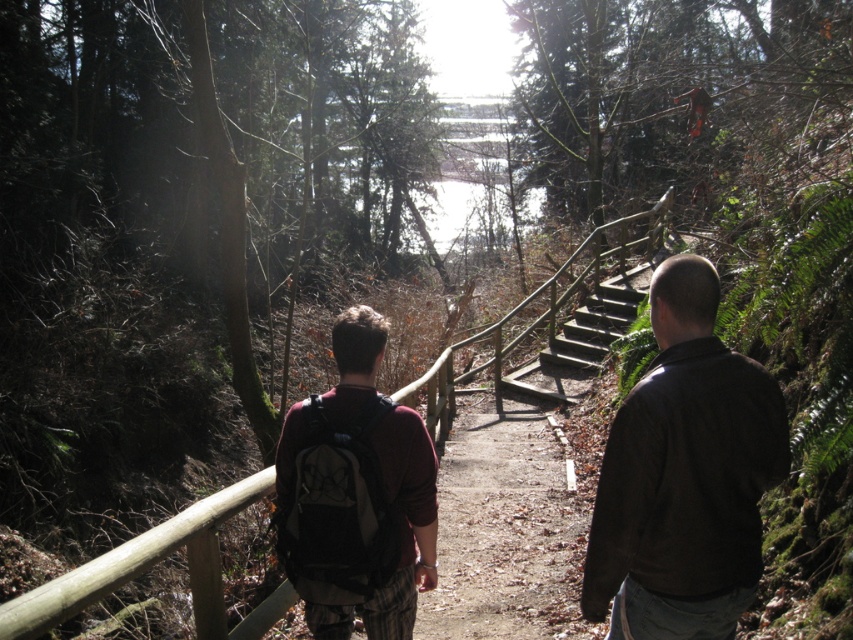
Question: Estimate the real-world distances between objects in this image. Which object is farther from the wooden at center?

Choices:
 (A) dark brown leather jacket at right
 (B) maroon fabric backpack at center

Answer: (B)

Question: Which object appears farthest from the camera in this image?

Choices:
 (A) dark brown leather jacket at right
 (B) wooden at center

Answer: (A)

Question: Is dark brown leather jacket at right below maroon fabric backpack at center?

Choices:
 (A) yes
 (B) no

Answer: (B)

Question: Can you confirm if maroon fabric backpack at center is smaller than wooden at center?

Choices:
 (A) yes
 (B) no

Answer: (A)

Question: Which point is closer to the camera?

Choices:
 (A) (738, 508)
 (B) (204, 525)

Answer: (A)

Question: Does maroon fabric backpack at center have a lesser width compared to wooden at center?

Choices:
 (A) yes
 (B) no

Answer: (A)